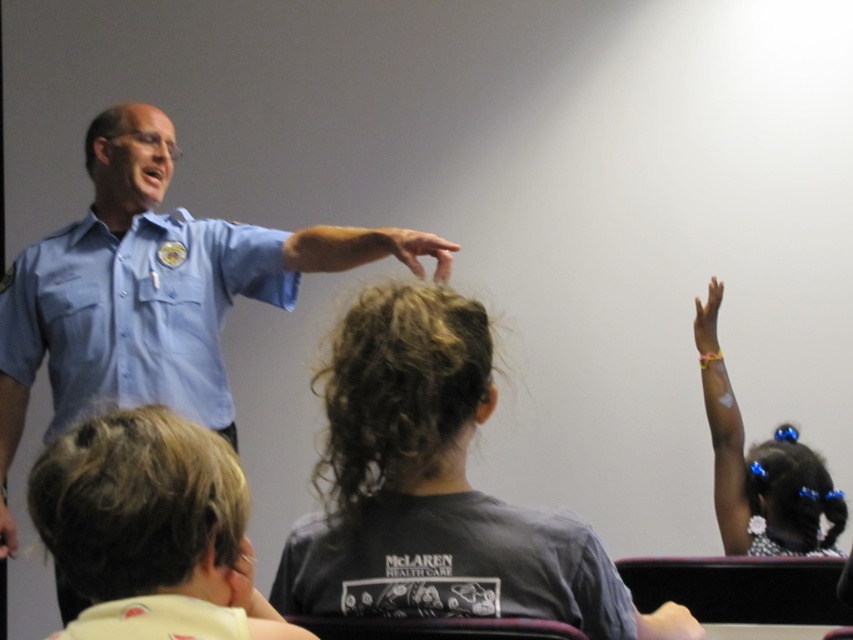
You are a photographer standing at the back of the classroom. You want to take a picture of the matte blue shirt at center and the black dotted dress at upper right. Can you fit both subjects into the frame if your camera has a 50 inch wide field of view?

The black dotted dress at upper right is 34.60 inches away from the matte blue shirt at center. Since the distance between them is less than the camera field of view of 50 inches, both subjects can be captured in the frame.